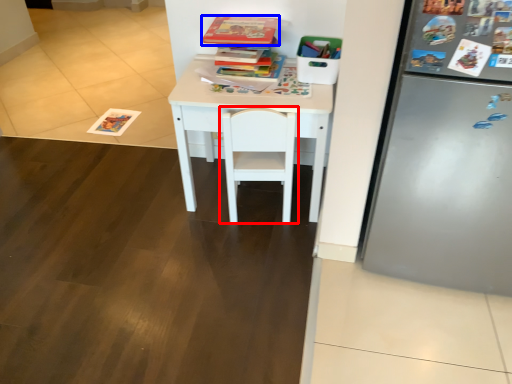
Question: Among these objects, which one is nearest to the camera, chair (highlighted by a red box) or book (highlighted by a blue box)?

Choices:
 (A) chair
 (B) book

Answer: (A)